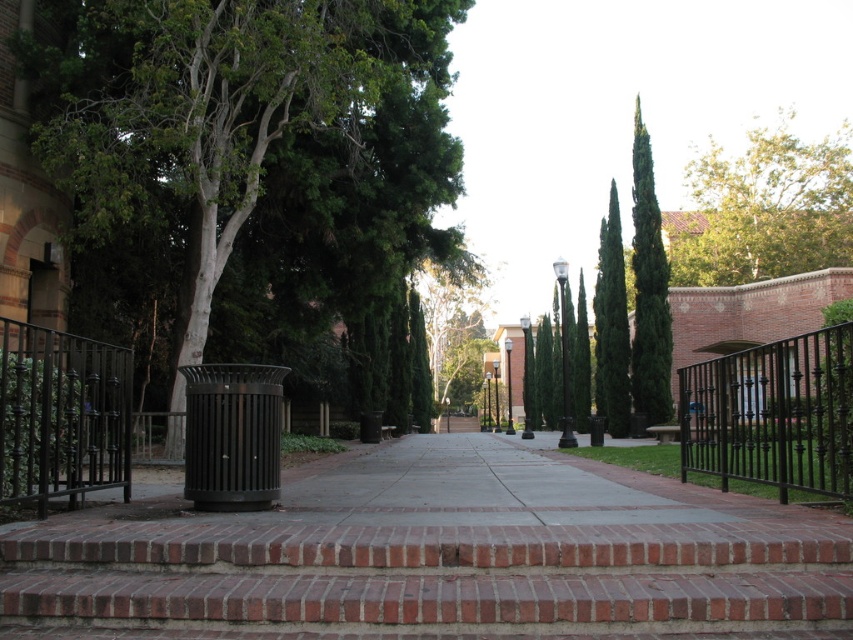
Question: Does black wrought iron fence at right have a greater width compared to green glossy cypress at upper right?

Choices:
 (A) yes
 (B) no

Answer: (A)

Question: In this image, where is green leafy tree at left located relative to black wrought iron fence at right?

Choices:
 (A) left
 (B) right

Answer: (A)

Question: Which of the following is the farthest from the observer?

Choices:
 (A) (793, 177)
 (B) (784, 486)
 (C) (219, 12)
 (D) (439, 365)

Answer: (D)

Question: Estimate the real-world distances between objects in this image. Which object is farther from the black wrought iron fence at left?

Choices:
 (A) green glossy tree at upper right
 (B) green leafy tree at center
 (C) green glossy cypress at upper right
 (D) black wrought iron fence at right

Answer: (B)

Question: Is the position of green leafy tree at left more distant than that of black wrought iron fence at left?

Choices:
 (A) yes
 (B) no

Answer: (A)

Question: Which point is closer to the camera?

Choices:
 (A) green leafy tree at upper right
 (B) green leafy tree at center
 (C) black wrought iron fence at left
 (D) green leafy tree at left

Answer: (C)